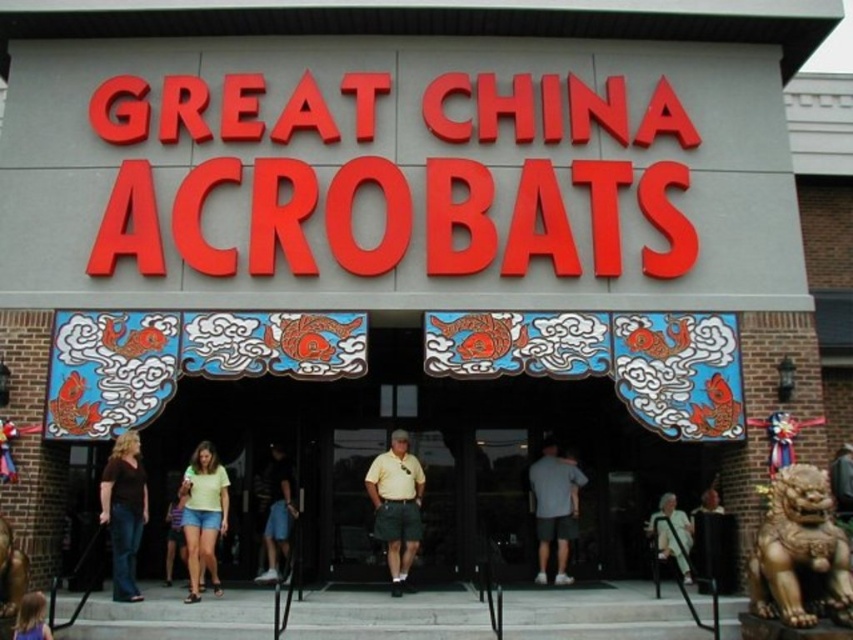
Question: Which object is farther from the camera taking this photo?

Choices:
 (A) white fabric at lower right
 (B) yellow matte shirt at center

Answer: (A)

Question: Can you confirm if yellow-green fabric shorts at center is positioned to the left of light brown hair at lower left?

Choices:
 (A) yes
 (B) no

Answer: (B)

Question: Which point appears farthest from the camera in this image?

Choices:
 (A) (218, 616)
 (B) (144, 513)
 (C) (367, 502)

Answer: (C)

Question: Does gray fabric shirt at center lie in front of dark blue shorts at center?

Choices:
 (A) no
 (B) yes

Answer: (B)

Question: Which object is farther from the camera taking this photo?

Choices:
 (A) white fabric at lower right
 (B) light brown hair at lower left

Answer: (A)

Question: Observing the image, what is the correct spatial positioning of gray concrete stairs at center in reference to dark brown denim jeans at lower left?

Choices:
 (A) left
 (B) right

Answer: (B)